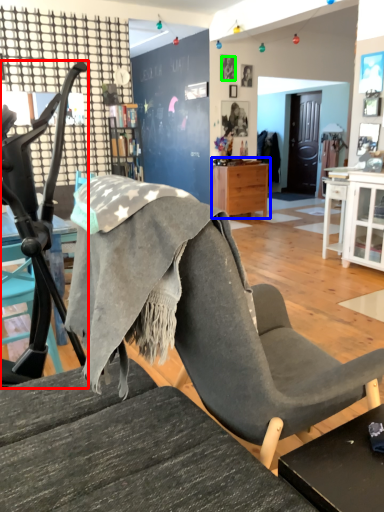
Question: Which object is the farthest from chair (highlighted by a red box)? Choose among these: nightstand (highlighted by a blue box) or person (highlighted by a green box).

Choices:
 (A) nightstand
 (B) person

Answer: (B)